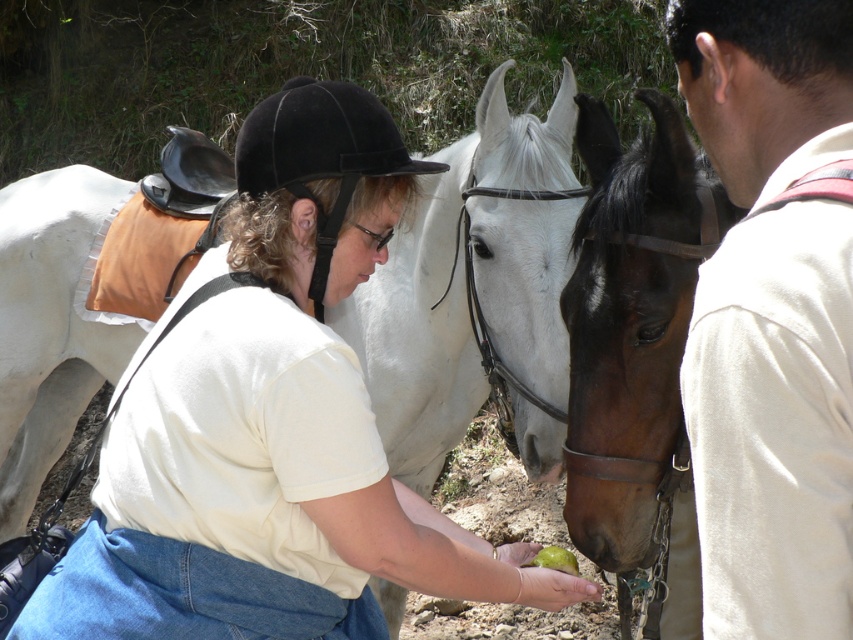
Question: Which of the following is the closest to the observer?

Choices:
 (A) (850, 77)
 (B) (579, 292)

Answer: (A)

Question: Is white glossy horse at center below white cotton shirt at center?

Choices:
 (A) yes
 (B) no

Answer: (A)

Question: Which point is closer to the camera taking this photo?

Choices:
 (A) (676, 282)
 (B) (251, 545)
 (C) (849, 109)

Answer: (C)

Question: Which point is closer to the camera?

Choices:
 (A) white cotton shirt at center
 (B) brown leather halter at center

Answer: (A)

Question: Is white glossy horse at center behind white cotton shirt at center?

Choices:
 (A) no
 (B) yes

Answer: (B)

Question: Does white cotton shirt at center have a smaller size compared to brown leather halter at center?

Choices:
 (A) no
 (B) yes

Answer: (B)